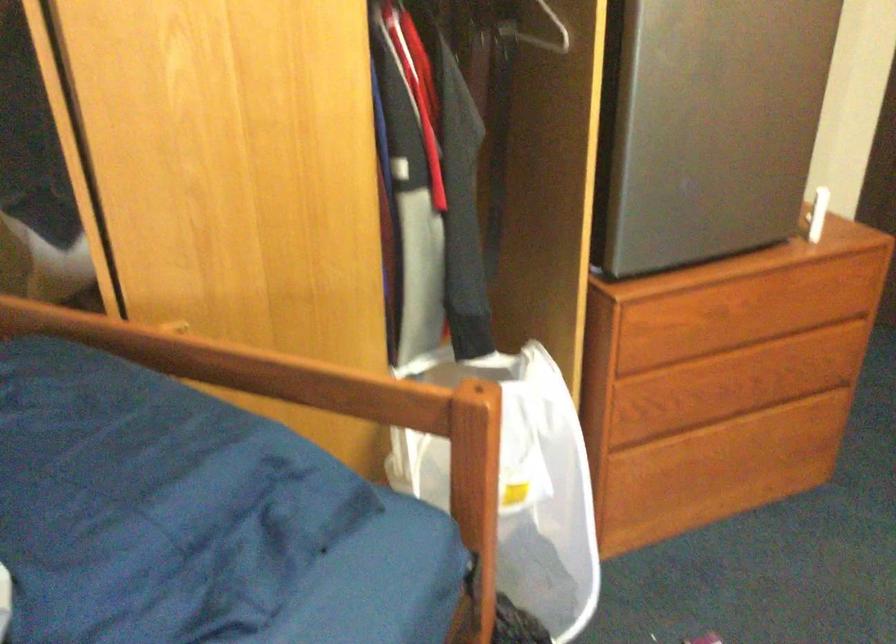
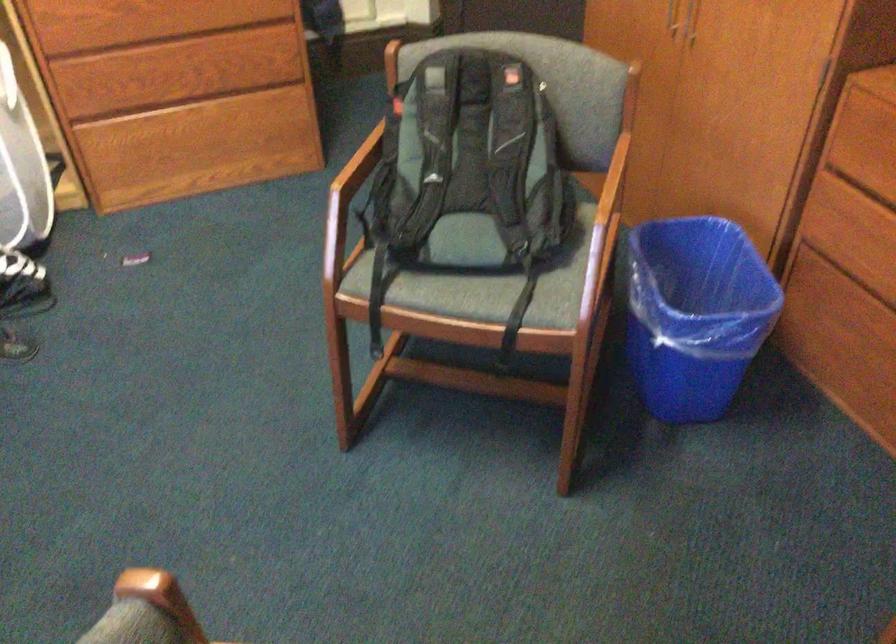
The images are taken continuously from a first-person perspective. In which direction are you moving?

The movement direction of the cameraman is right, backward.